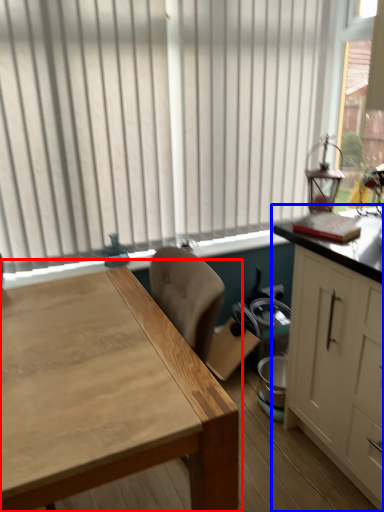
Question: Which of the following is the closest to the observer, table (highlighted by a red box) or cabinetry (highlighted by a blue box)?

Choices:
 (A) table
 (B) cabinetry

Answer: (A)